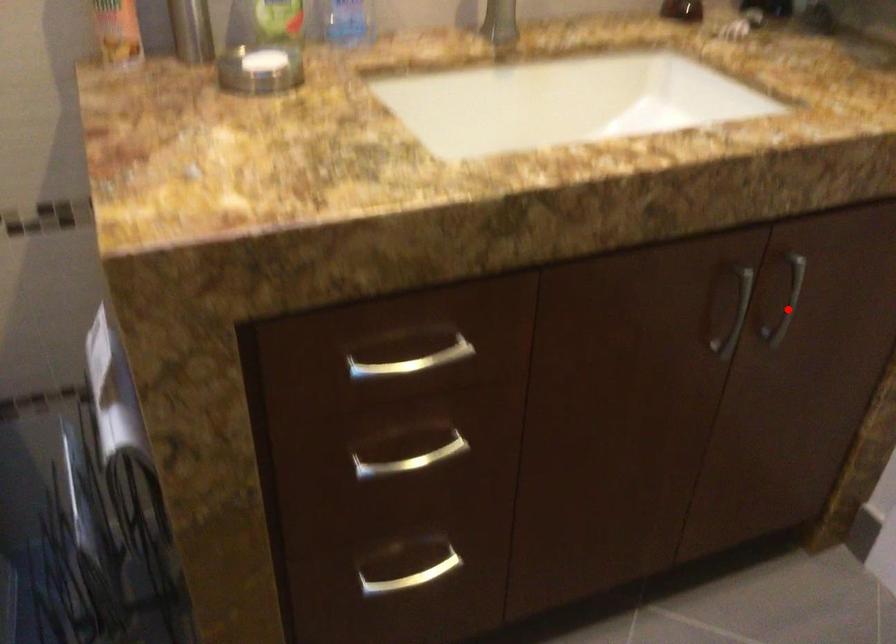
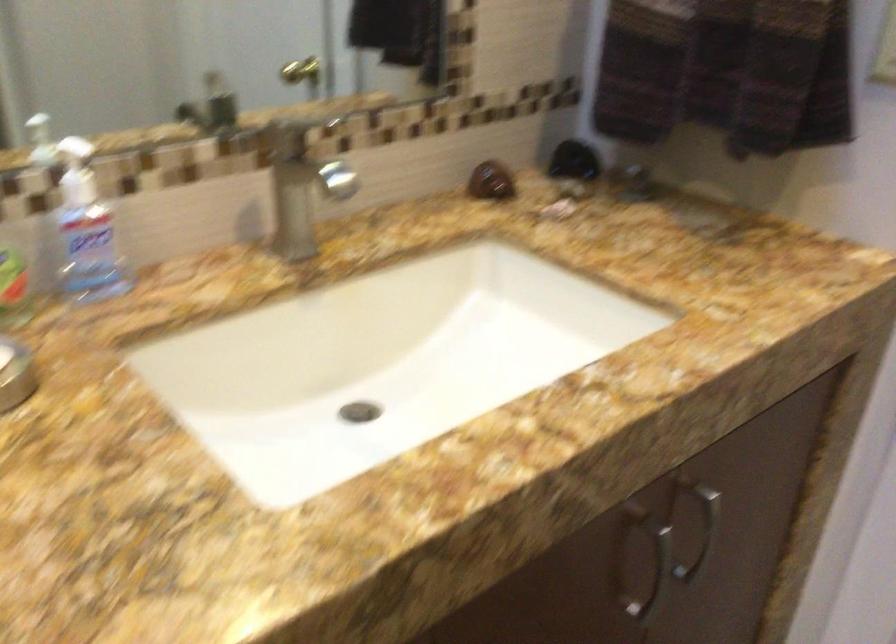
Question: I am providing you with two images of the same scene from different viewpoints. Given a red point in image1, look at the same physical point in image2. Is it:

Choices:
 (A) Closer to the viewpoint
 (B) Farther from the viewpoint

Answer: (A)